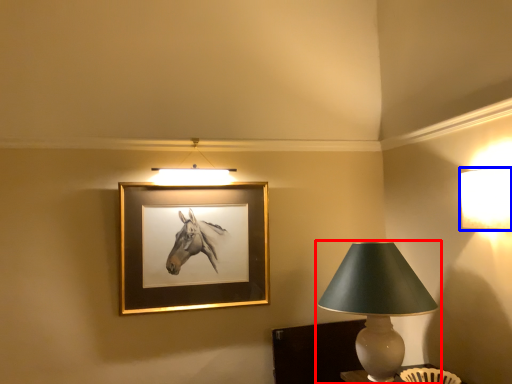
Question: Which object appears farthest to the camera in this image, lamp (highlighted by a red box) or lamp (highlighted by a blue box)?

Choices:
 (A) lamp
 (B) lamp

Answer: (A)